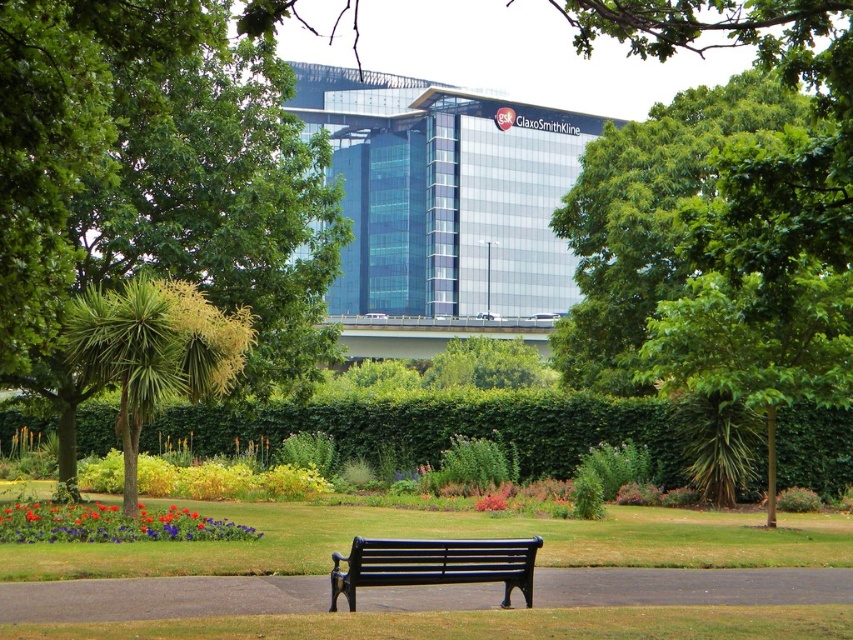
You are standing in the park and see the green leafy tree at center and the green leafy tree at left. Which tree is positioned more to the left?

The green leafy tree at left is positioned more to the left than the green leafy tree at center.

You are standing at the entrance of the park and see the green leafy tree at center. If you walk straight ahead, will the tree be in your path?

The green leafy tree at center is located at point [155,182], which is not directly in front of you if you walk straight ahead from the entrance. Therefore, the tree will not be in your path.

Based on the photo, you are standing at the entrance of the park and want to find the black metal bench at center. Which direction should you walk to reach it from the green leafy tree at left?

The green leafy tree at left is to the left of the black metal bench at center, so you should walk to the right from the green leafy tree at left to reach the black metal bench at center.